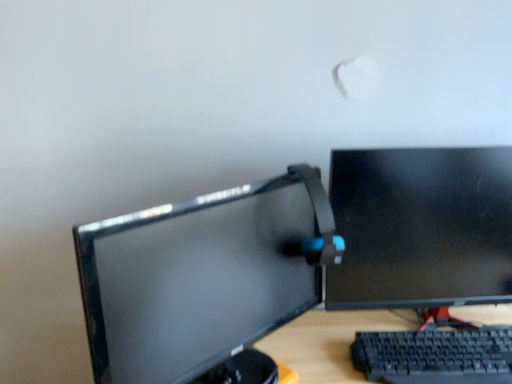
Question: From their relative heights in the image, would you say matte black monitor at center, which appears as the first computer monitor when viewed from the left, is taller or shorter than black plastic keyboard at lower right?

Choices:
 (A) tall
 (B) short

Answer: (A)

Question: From the image's perspective, is matte black monitor at center, arranged as the second computer monitor when viewed from the right, located above or below black plastic keyboard at lower right?

Choices:
 (A) above
 (B) below

Answer: (A)

Question: Estimate the real-world distances between objects in this image. Which object is farther from the matte black monitor at center, which appears as the first computer monitor when viewed from the left?

Choices:
 (A) black plastic keyboard at lower right
 (B) black glossy monitor at right, the 1th computer monitor in the right-to-left sequence

Answer: (A)

Question: Which object is positioned farthest from the black plastic keyboard at lower right?

Choices:
 (A) black glossy monitor at right, the 1th computer monitor in the right-to-left sequence
 (B) matte black monitor at center, which appears as the first computer monitor when viewed from the left

Answer: (B)